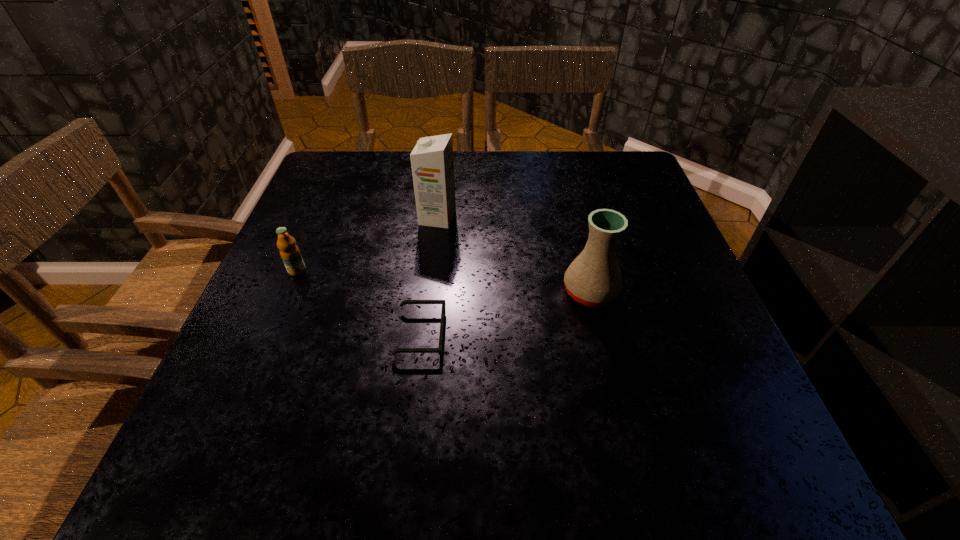
This screenshot has width=960, height=540. Identify the location of vacant area at the far edge. (483, 191).

Locate an element on the screen. blank space at the near edge of the desktop is located at coordinates (485, 437).

In the image, there is a desktop. What are the coordinates of `vacant space at the left edge` in the screenshot? It's located at (357, 225).

In order to click on vacant space at the right edge in this screenshot , I will do `click(661, 230)`.

Identify the location of vacant region at the far left corner of the desktop. This screenshot has width=960, height=540. (333, 167).

At what (x,y) coordinates should I click in order to perform the action: click on blank space at the near right corner. Please return your answer as a coordinate pair (x, y). This screenshot has width=960, height=540. Looking at the image, I should click on (760, 447).

At what (x,y) coordinates should I click in order to perform the action: click on vacant area that lies between the pottery and the orange juice. Please return your answer as a coordinate pair (x, y). Looking at the image, I should click on (444, 281).

Identify the location of free area in between the farthest object and the orange juice. (368, 244).

Where is `vacant point located between the shortest object and the farthest object`? vacant point located between the shortest object and the farthest object is located at coordinates (429, 276).

Identify the location of empty space between the carton and the sunglasses. (429, 276).